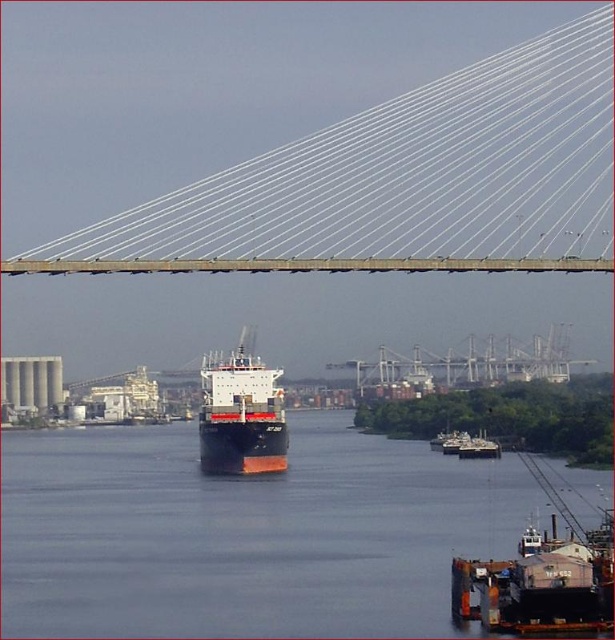
Can you confirm if dark blue water at center is thinner than metallic gray suspension bridge at center?

No.

Who is taller, dark blue water at center or metallic gray suspension bridge at center?

dark blue water at center

The height and width of the screenshot is (640, 615). I want to click on dark blue water at center, so click(247, 532).

The image size is (615, 640). Find the location of `dark blue water at center`. dark blue water at center is located at coordinates (247, 532).

Which is behind, point (85, 477) or point (274, 458)?

Point (85, 477)

Identify the location of dark blue water at center. (247, 532).

Based on the photo, is white cable-stayed bridge at upper center bigger than metallic gray suspension bridge at center?

Correct, white cable-stayed bridge at upper center is larger in size than metallic gray suspension bridge at center.

The width and height of the screenshot is (615, 640). What do you see at coordinates (400, 182) in the screenshot? I see `white cable-stayed bridge at upper center` at bounding box center [400, 182].

Locate an element on the screen. Image resolution: width=615 pixels, height=640 pixels. white cable-stayed bridge at upper center is located at coordinates (400, 182).